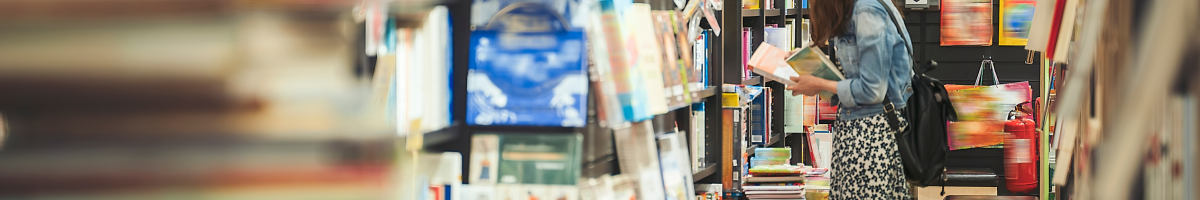
Locate an element on the screen. book shelves is located at coordinates (524, 49), (774, 0), (781, 127).